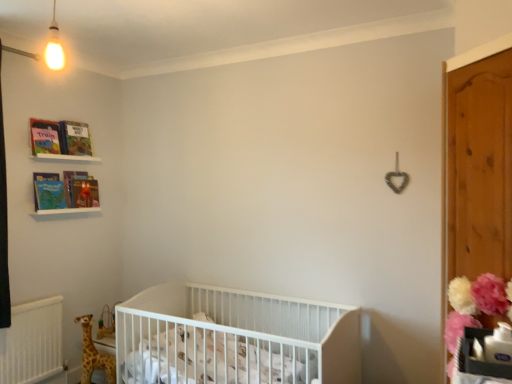
Question: In the image, is matte cardboard book at upper left, arranged as the second book when ordered from the bottom, on the left side or the right side of white plastic crib at upper left, positioned as the 1th balustrade in top-to-bottom order?

Choices:
 (A) right
 (B) left

Answer: (A)

Question: Do you think matte cardboard book at upper left, the first book from the top, is within white plastic crib at upper left, positioned as the 1th balustrade in top-to-bottom order, or outside of it?

Choices:
 (A) outside
 (B) inside

Answer: (A)

Question: Which object is positioned closest to the white plastic crib at upper left, positioned as the 1th balustrade in top-to-bottom order?

Choices:
 (A) fluffy pink pom-pom at right
 (B) hardcover book at upper left, the second book positioned from the top
 (C) white plastic crib at lower left, arranged as the second balustrade when viewed from the top
 (D) matte cardboard book at upper left, arranged as the second book when ordered from the bottom
 (E) white matte crib at center

Answer: (D)

Question: Considering the real-world distances, which object is farthest from the hardcover book at upper left, the second book positioned from the top?

Choices:
 (A) white plastic crib at lower left, arranged as the second balustrade when viewed from the top
 (B) spotted fabric giraffe at lower left
 (C) matte cardboard book at upper left, arranged as the second book when ordered from the bottom
 (D) white plastic crib at upper left, arranged as the second balustrade when ordered from the bottom
 (E) matte paper book at upper left, which is counted as the 2th magazine, starting from the front

Answer: (B)